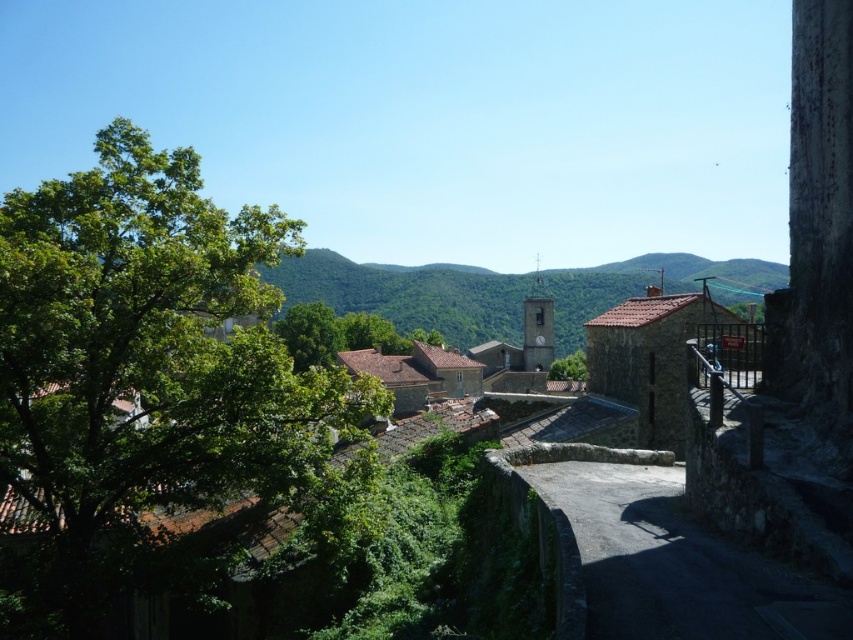
You are standing in the village and want to take a photo of the dark stone alley at center and the green leafy tree at center. Which one should you focus on first to ensure both are in sharp focus?

You should focus on the dark stone alley at center first because it is closer to the viewer than the green leafy tree at center, so adjusting focus from near to far will help both be in focus.

You are a tourist standing at the entrance of the village and want to take a photo that includes both the green leafy tree at upper left and the dark stone alley at center. Which object should you position closer to the edge of the frame to ensure both fit in the shot?

Since the green leafy tree at upper left might be wider than the dark stone alley at center, you should position the green leafy tree at upper left closer to the edge of the frame to ensure both fit in the shot.